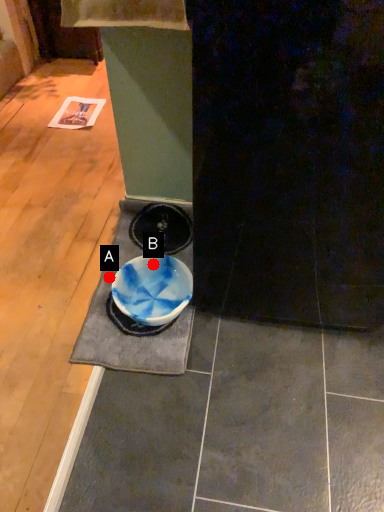
Question: Two points are circled on the image, labeled by A and B beside each circle. Which point appears closest to the camera in this image?

Choices:
 (A) A is closer
 (B) B is closer

Answer: (A)